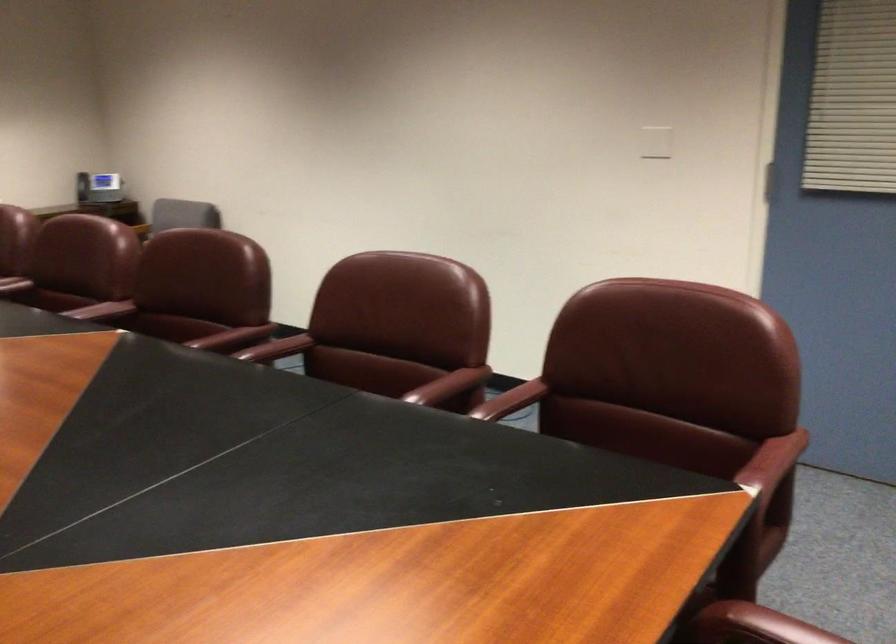
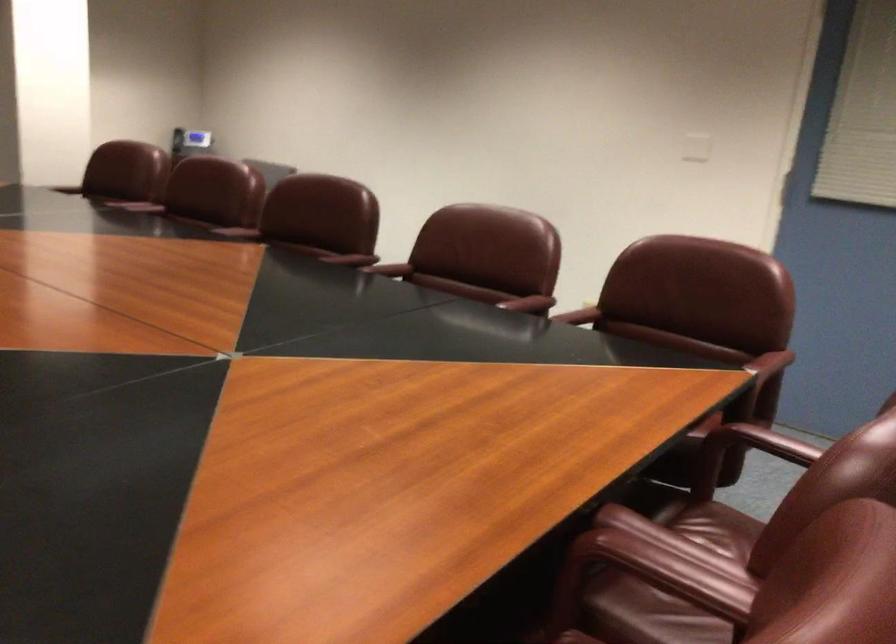
Locate, in the second image, the point that corresponds to point (445, 386) in the first image.

(529, 303)